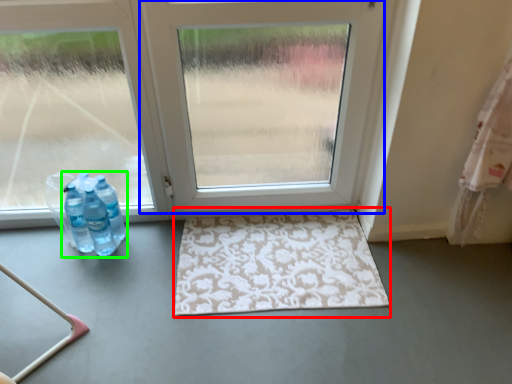
Question: Estimate the real-world distances between objects in this image. Which object is farther from bath mat (highlighted by a red box), door (highlighted by a blue box) or bottle (highlighted by a green box)?

Choices:
 (A) door
 (B) bottle

Answer: (B)